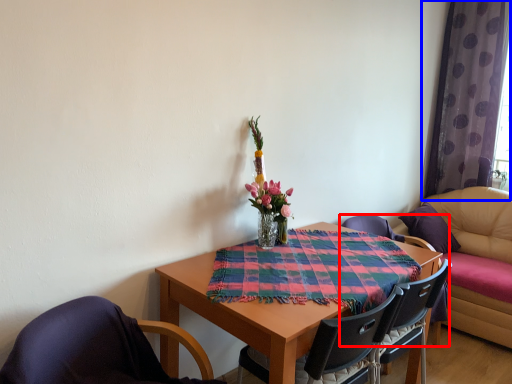
Question: Which object appears closest to the camera in this image, chair (highlighted by a red box) or curtain (highlighted by a blue box)?

Choices:
 (A) chair
 (B) curtain

Answer: (A)